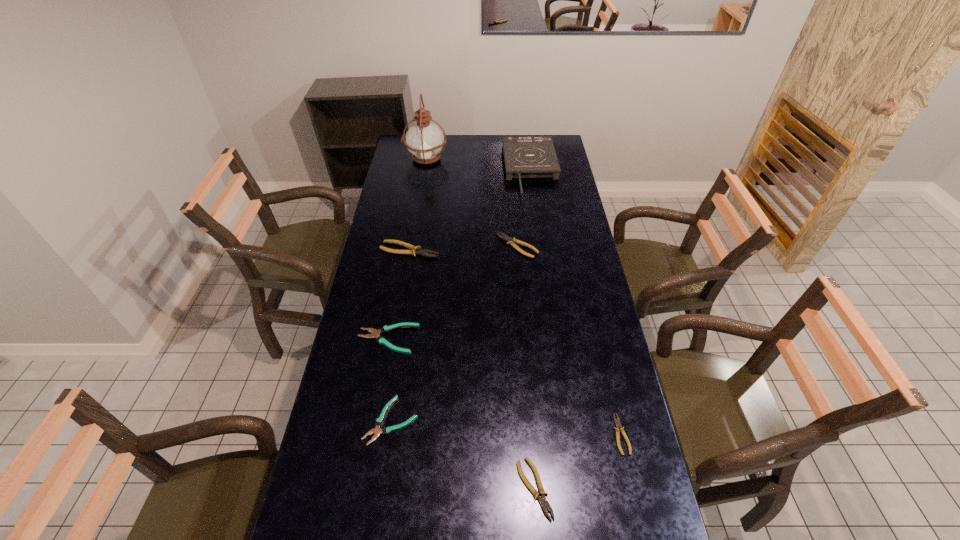
You are a GUI agent. You are given a task and a screenshot of the screen. Output one action in this format:
    pyautogui.click(x=<x>, y=<y>)
    Task: Click on the smaller teal pliers
    The image size is (960, 540).
    Given the screenshot: What is the action you would take?
    pyautogui.click(x=377, y=430)

Find the location of a particular element. This screenshot has height=540, width=960. the smallest yellow pliers is located at coordinates (617, 422).

Locate an element on the screen. This screenshot has height=540, width=960. the rightmost pliers is located at coordinates (617, 422).

Image resolution: width=960 pixels, height=540 pixels. I want to click on vacant space situated 0.390m on the front of the tallest object, so click(417, 219).

What are the coordinates of `free region located on the left of the second tallest object` in the screenshot? It's located at (454, 171).

Locate an element on the screen. This screenshot has height=540, width=960. free spot located on the back of the biggest yellow pliers is located at coordinates (418, 204).

Where is `free location located 0.290m on the left of the fifth shortest pliers`? The height and width of the screenshot is (540, 960). free location located 0.290m on the left of the fifth shortest pliers is located at coordinates (427, 246).

In order to click on free spot located on the back of the bigger teal pliers in this screenshot , I will do `click(397, 285)`.

The width and height of the screenshot is (960, 540). I want to click on free space located on the right of the nearest object, so click(570, 489).

This screenshot has width=960, height=540. Find the location of `vacant space situated on the right of the nearer teal pliers`. vacant space situated on the right of the nearer teal pliers is located at coordinates (512, 420).